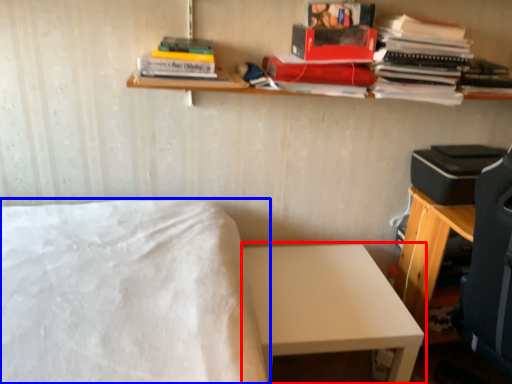
Question: Which object is closer to the camera taking this photo, table (highlighted by a red box) or bed (highlighted by a blue box)?

Choices:
 (A) table
 (B) bed

Answer: (B)